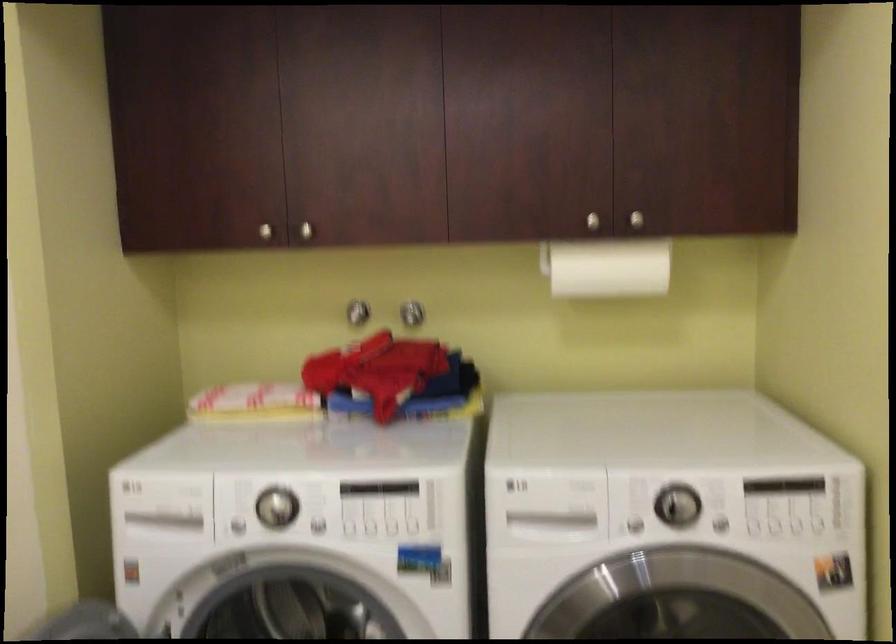
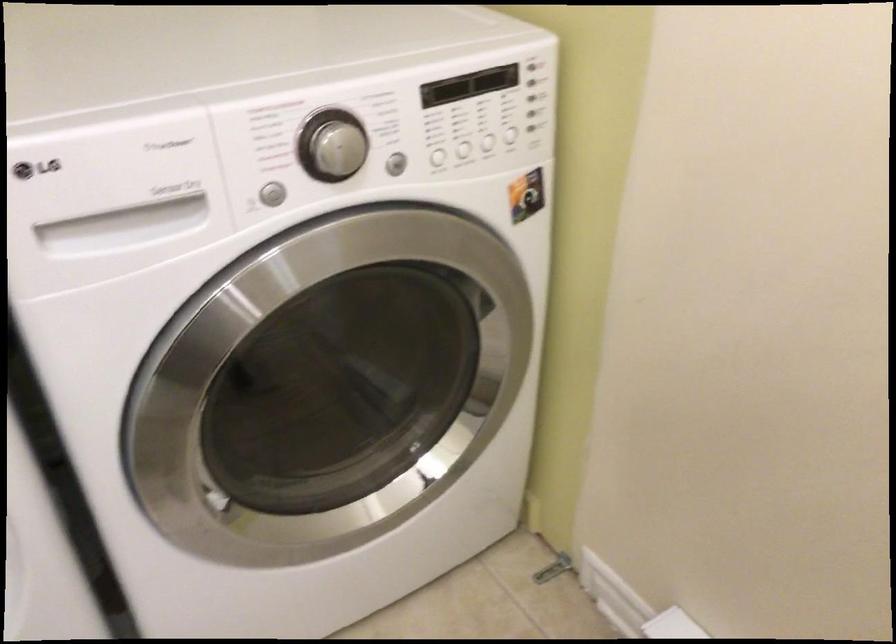
Locate, in the second image, the point that corresponds to pixel 635 525 in the first image.

(269, 194)